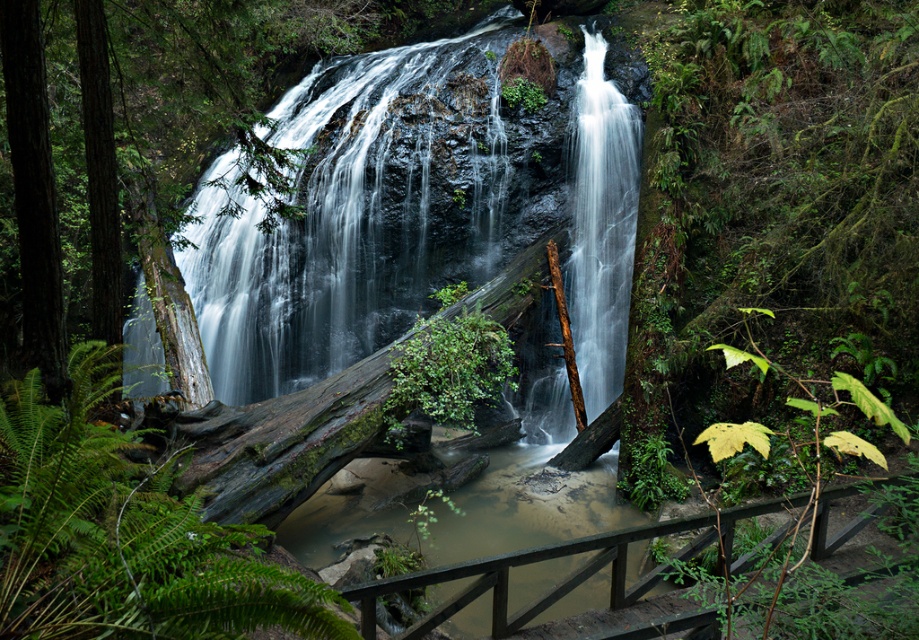
Question: Can you confirm if white smooth water at center is positioned to the left of green mossy log at center?

Choices:
 (A) no
 (B) yes

Answer: (A)

Question: Which point is closer to the camera?

Choices:
 (A) (394, 428)
 (B) (475, 156)
 (C) (627, 269)
 (D) (618, 586)

Answer: (D)

Question: Among these points, which one is farthest from the camera?

Choices:
 (A) tap(399, 400)
 (B) tap(101, 353)
 (C) tap(576, 260)
 (D) tap(557, 371)

Answer: (C)

Question: Which point is farther to the camera?

Choices:
 (A) (9, 605)
 (B) (488, 344)
 (C) (741, 513)
 (D) (284, 360)

Answer: (D)

Question: Is green matte fern at center wider than green mossy log at center?

Choices:
 (A) yes
 (B) no

Answer: (A)

Question: From the image, what is the correct spatial relationship of smooth rock waterfall at center in relation to green matte fern at center?

Choices:
 (A) left
 (B) right

Answer: (B)